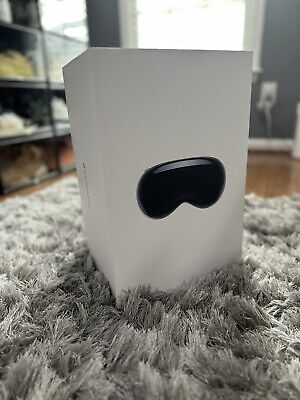
Where is `flooring`? This screenshot has width=300, height=400. flooring is located at coordinates (284, 159), (270, 174), (267, 171).